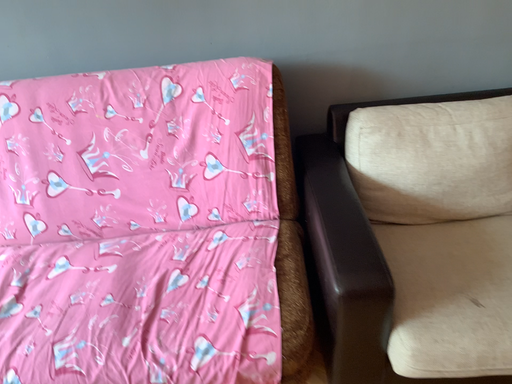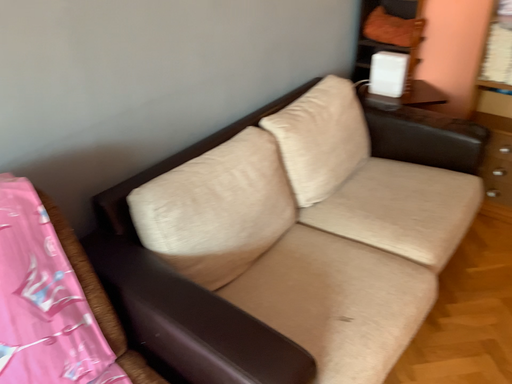
Question: How did the camera likely rotate when shooting the video?

Choices:
 (A) rotated right
 (B) rotated left

Answer: (A)